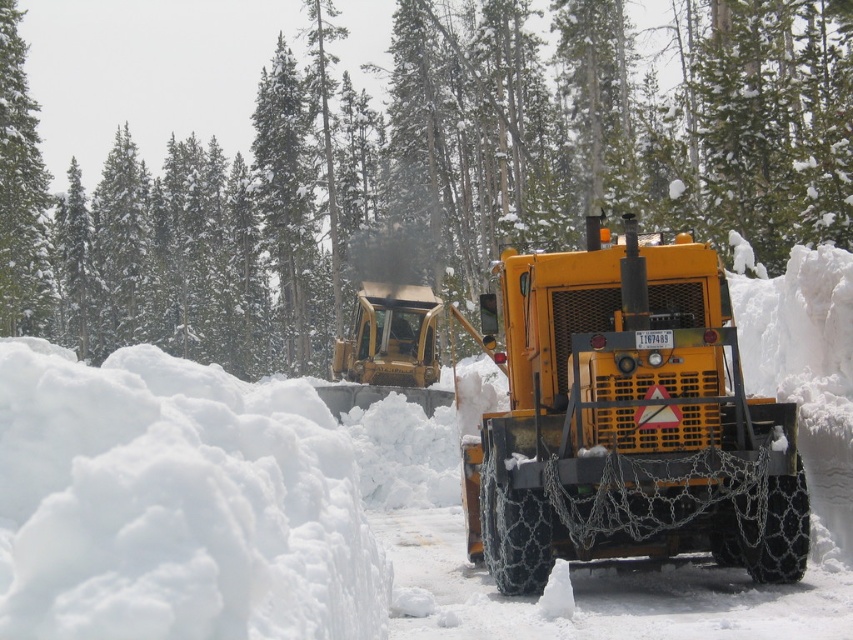
You are a delivery driver trying to navigate through the snowy path. You see the green textured tree at center and the yellow metallic plow at center. Which object is blocking your path more?

The green textured tree at center is positioned over the yellow metallic plow at center, so the tree is blocking the path more than the plow.

You are a pedestrian trying to cross the road in this snowy forest scene. You see the green textured tree at center and the yellow metallic plow at center. Which object is closer to your left side as you face the direction of the yellow metallic plow?

The green textured tree at center is to the left of the yellow metallic plow at center, so when facing the direction of the yellow metallic plow, the green textured tree at center would be on your left side.